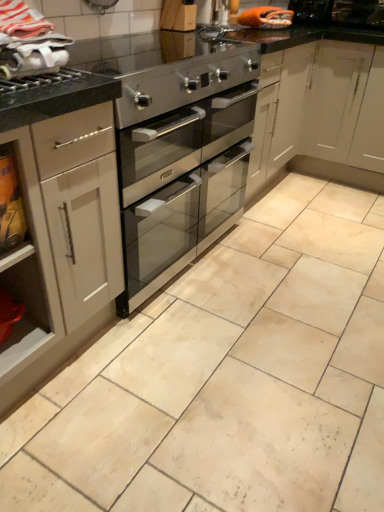
Question: From the image's perspective, relative to brushed metal gas stove at upper left, is satin silver oven at center above or below?

Choices:
 (A) below
 (B) above

Answer: (A)

Question: Considering the positions of satin silver oven at center and brushed metal gas stove at upper left in the image, is satin silver oven at center taller or shorter than brushed metal gas stove at upper left?

Choices:
 (A) tall
 (B) short

Answer: (A)

Question: Based on their relative distances, which object is farther from the white matte cabinet at left?

Choices:
 (A) brushed metal gas stove at upper left
 (B) stainless steel oven at center
 (C) stainless steel oven at upper left
 (D) white fabric at upper left
 (E) satin silver oven at center

Answer: (C)

Question: Estimate the real-world distances between objects in this image. Which object is farther from the satin silver oven at center?

Choices:
 (A) stainless steel oven at upper left
 (B) stainless steel oven at center
 (C) white fabric at upper left
 (D) white matte cabinet at left
 (E) brushed metal gas stove at upper left

Answer: (C)